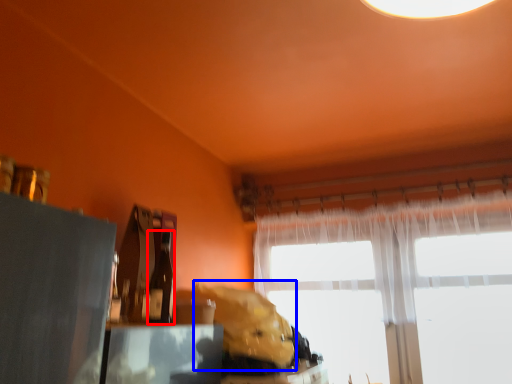
Question: Which of the following is the closest to the observer, bottle (highlighted by a red box) or animal (highlighted by a blue box)?

Choices:
 (A) bottle
 (B) animal

Answer: (A)